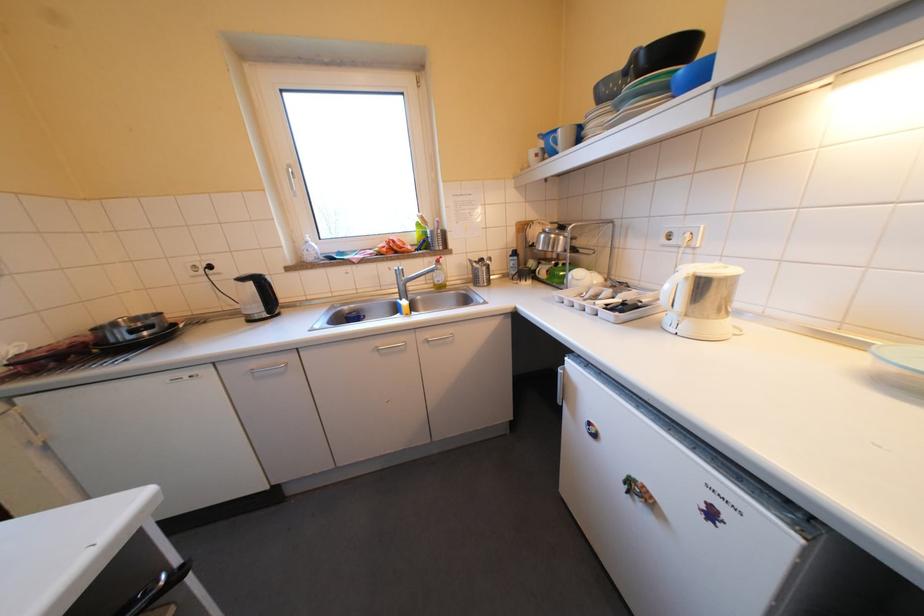
Identify the location of silver kettle handle. (409, 278).